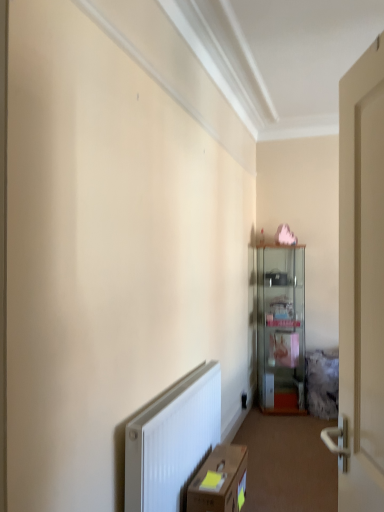
Question: Is brown cardboard box at lower center next to clear glass cabinet at center and touching it?

Choices:
 (A) yes
 (B) no

Answer: (B)

Question: From the image's perspective, would you say brown cardboard box at lower center is positioned over clear glass cabinet at center?

Choices:
 (A) yes
 (B) no

Answer: (B)

Question: Does brown cardboard box at lower center appear on the right side of clear glass cabinet at center?

Choices:
 (A) yes
 (B) no

Answer: (B)

Question: Is brown cardboard box at lower center facing towards clear glass cabinet at center?

Choices:
 (A) no
 (B) yes

Answer: (A)

Question: Is brown cardboard box at lower center located outside clear glass cabinet at center?

Choices:
 (A) yes
 (B) no

Answer: (A)

Question: Is brown cardboard box at lower center taller than clear glass cabinet at center?

Choices:
 (A) no
 (B) yes

Answer: (A)

Question: From the image's perspective, is clear glass cabinet at center on brown cardboard box at lower center?

Choices:
 (A) yes
 (B) no

Answer: (A)

Question: Is clear glass cabinet at center facing towards brown cardboard box at lower center?

Choices:
 (A) yes
 (B) no

Answer: (B)

Question: Is clear glass cabinet at center at the left side of brown cardboard box at lower center?

Choices:
 (A) yes
 (B) no

Answer: (B)

Question: Does clear glass cabinet at center have a larger size compared to brown cardboard box at lower center?

Choices:
 (A) no
 (B) yes

Answer: (B)

Question: From a real-world perspective, is clear glass cabinet at center over brown cardboard box at lower center?

Choices:
 (A) no
 (B) yes

Answer: (B)

Question: Does clear glass cabinet at center have a greater height compared to brown cardboard box at lower center?

Choices:
 (A) no
 (B) yes

Answer: (B)

Question: In terms of height, does brown cardboard box at lower center look taller or shorter compared to clear glass cabinet at center?

Choices:
 (A) tall
 (B) short

Answer: (B)